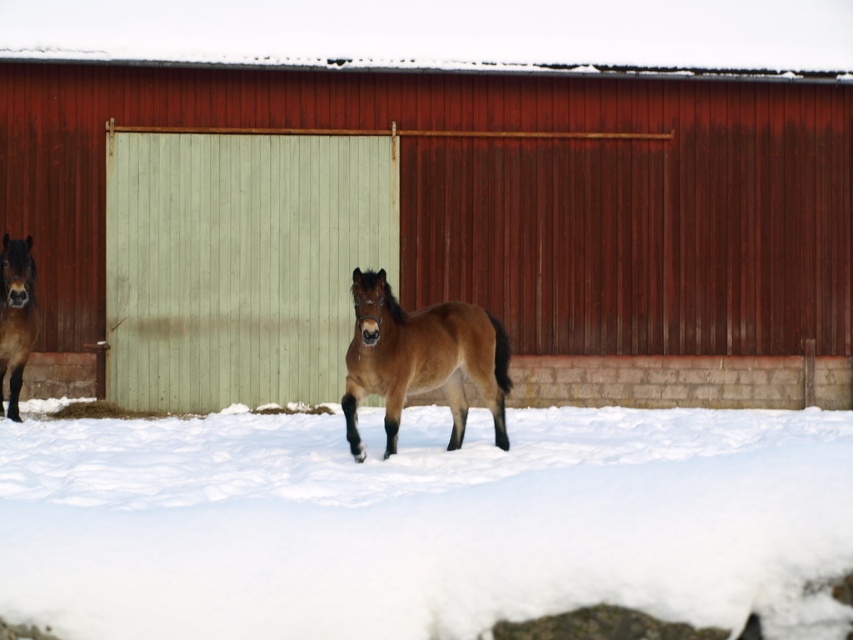
You are standing in the winter scene and want to know how far the point at coordinates (252, 240) is from you. Can you determine the distance?

The distance of point (252, 240) from the viewer is 55.68 feet.

You are a photographer trying to capture the smooth wooden barn at center and the brown glossy horse at left in a single frame. Based on their positions, which object should you position closer to the left edge of your camera viewfinder?

The brown glossy horse at left should be positioned closer to the left edge of the camera viewfinder since it is located to the left of the smooth wooden barn at center.

You are a farmer checking the barn. You see the green corrugated metal at center and the brown glossy horse at left. Which object is positioned higher in the scene?

The green corrugated metal at center is located above the brown glossy horse at left, so it is positioned higher in the scene.